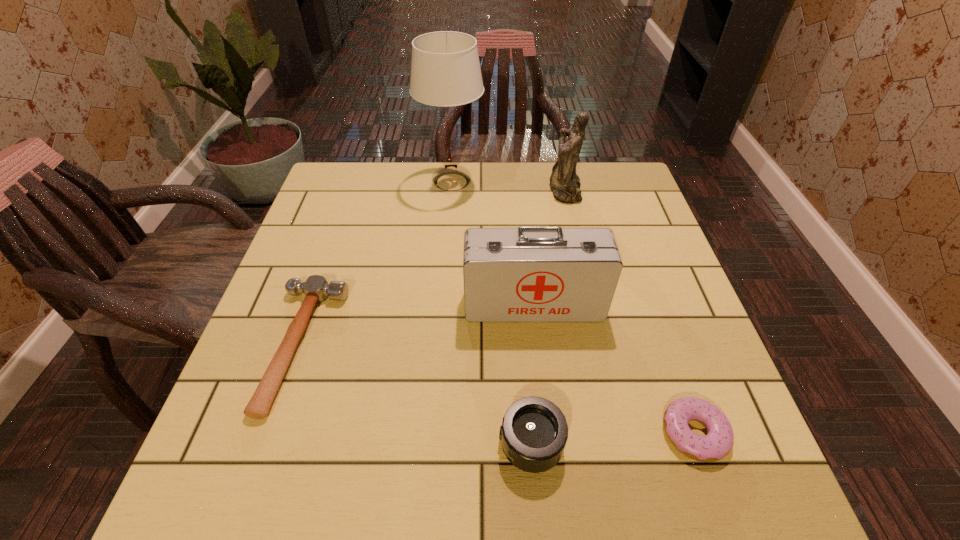
You are a GUI agent. You are given a task and a screenshot of the screen. Output one action in this format:
    pyautogui.click(x=<x>, y=<y>)
    Task: Click on the telephoto lens that is at the near edge
    
    Given the screenshot: What is the action you would take?
    pyautogui.click(x=534, y=431)

Locate an element on the screen. The height and width of the screenshot is (540, 960). doughnut that is at the near edge is located at coordinates (718, 442).

Locate an element on the screen. object present at the left edge is located at coordinates (316, 288).

The width and height of the screenshot is (960, 540). What are the coordinates of `object at the right edge` in the screenshot? It's located at (718, 442).

Find the location of a particular element. object present at the near right corner is located at coordinates (718, 442).

In the image, there is a desktop. What are the coordinates of `vacant region at the far edge` in the screenshot? It's located at (503, 188).

Find the location of a particular element. This screenshot has width=960, height=540. free space at the near edge of the desktop is located at coordinates (371, 461).

In the image, there is a desktop. Identify the location of free region at the left edge. (316, 275).

Image resolution: width=960 pixels, height=540 pixels. I want to click on free space at the right edge of the desktop, so click(x=670, y=259).

The width and height of the screenshot is (960, 540). In the image, there is a desktop. Find the location of `vacant area at the far left corner`. vacant area at the far left corner is located at coordinates click(x=354, y=173).